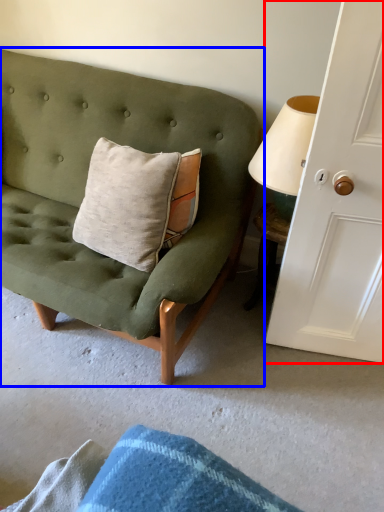
Question: Which point is closer to the camera, door (highlighted by a red box) or studio couch (highlighted by a blue box)?

Choices:
 (A) door
 (B) studio couch

Answer: (A)